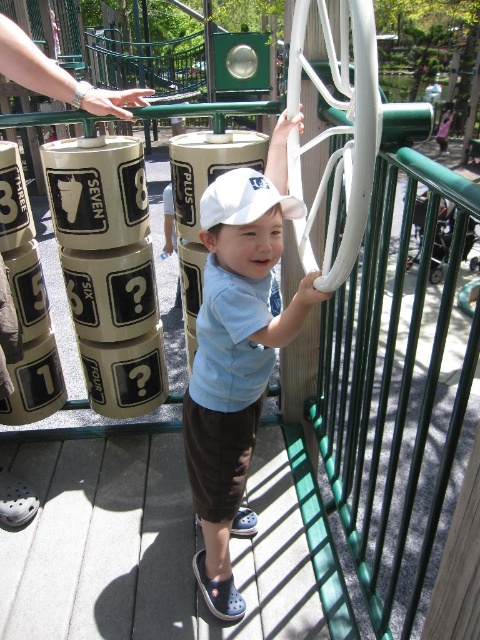
Question: Which point is closer to the camera?

Choices:
 (A) (297, 296)
 (B) (238, 211)

Answer: (A)

Question: Does light blue t-shirt at center have a smaller size compared to white matte baseball cap at center?

Choices:
 (A) yes
 (B) no

Answer: (B)

Question: Which point is farther from the camera taking this photo?

Choices:
 (A) (252, 330)
 (B) (217, 204)

Answer: (A)

Question: Considering the relative positions of light blue t-shirt at center and white matte baseball cap at center in the image provided, where is light blue t-shirt at center located with respect to white matte baseball cap at center?

Choices:
 (A) below
 (B) above

Answer: (A)

Question: Among these objects, which one is nearest to the camera?

Choices:
 (A) white matte baseball cap at center
 (B) light blue t-shirt at center

Answer: (B)

Question: Can you confirm if light blue t-shirt at center is positioned to the left of white matte baseball cap at center?

Choices:
 (A) yes
 (B) no

Answer: (A)